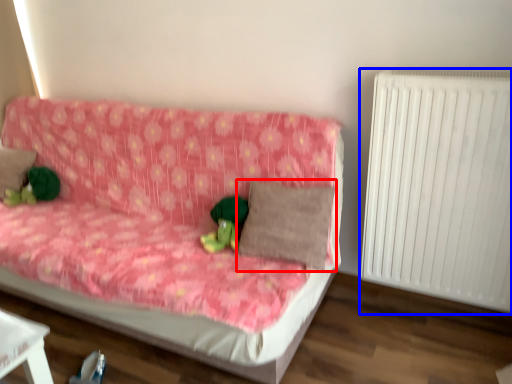
Question: Which object appears farthest to the camera in this image, pillow (highlighted by a red box) or radiator (highlighted by a blue box)?

Choices:
 (A) pillow
 (B) radiator

Answer: (A)